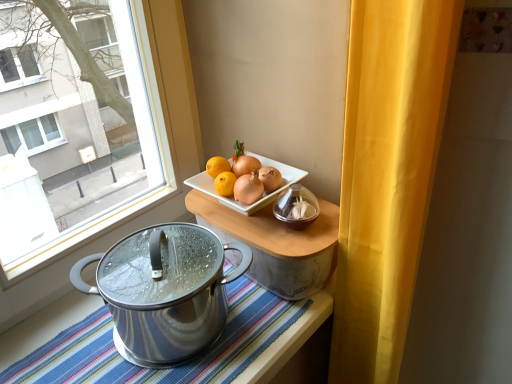
Question: Is striped fabric tablecloth at lower center touching yellow fabric curtain at right?

Choices:
 (A) yes
 (B) no

Answer: (B)

Question: Can you confirm if striped fabric tablecloth at lower center is smaller than yellow fabric curtain at right?

Choices:
 (A) yes
 (B) no

Answer: (A)

Question: From a real-world perspective, is striped fabric tablecloth at lower center physically above yellow fabric curtain at right?

Choices:
 (A) no
 (B) yes

Answer: (B)

Question: From the image's perspective, is striped fabric tablecloth at lower center below yellow fabric curtain at right?

Choices:
 (A) no
 (B) yes

Answer: (A)

Question: Considering the relative sizes of striped fabric tablecloth at lower center and yellow fabric curtain at right in the image provided, is striped fabric tablecloth at lower center taller than yellow fabric curtain at right?

Choices:
 (A) yes
 (B) no

Answer: (B)

Question: In terms of size, does yellow fabric curtain at right appear bigger or smaller than striped fabric tablecloth at lower center?

Choices:
 (A) small
 (B) big

Answer: (B)

Question: Is yellow fabric curtain at right taller or shorter than striped fabric tablecloth at lower center?

Choices:
 (A) tall
 (B) short

Answer: (A)

Question: In the image, is yellow fabric curtain at right on the left side or the right side of striped fabric tablecloth at lower center?

Choices:
 (A) left
 (B) right

Answer: (B)

Question: From a real-world perspective, is yellow fabric curtain at right physically located above or below striped fabric tablecloth at lower center?

Choices:
 (A) below
 (B) above

Answer: (A)

Question: Is point (208, 314) closer or farther from the camera than point (355, 301)?

Choices:
 (A) farther
 (B) closer

Answer: (B)

Question: In terms of size, does polished stainless steel pot at lower left appear bigger or smaller than yellow fabric curtain at right?

Choices:
 (A) small
 (B) big

Answer: (A)

Question: From the image's perspective, is polished stainless steel pot at lower left above or below yellow fabric curtain at right?

Choices:
 (A) below
 (B) above

Answer: (B)

Question: Considering their positions, is polished stainless steel pot at lower left located in front of or behind yellow fabric curtain at right?

Choices:
 (A) behind
 (B) front

Answer: (A)

Question: Considering the positions of point (327, 317) and point (297, 286), is point (327, 317) closer or farther from the camera than point (297, 286)?

Choices:
 (A) closer
 (B) farther

Answer: (B)

Question: Is striped fabric tablecloth at lower center bigger or smaller than wooden tray at center?

Choices:
 (A) small
 (B) big

Answer: (B)